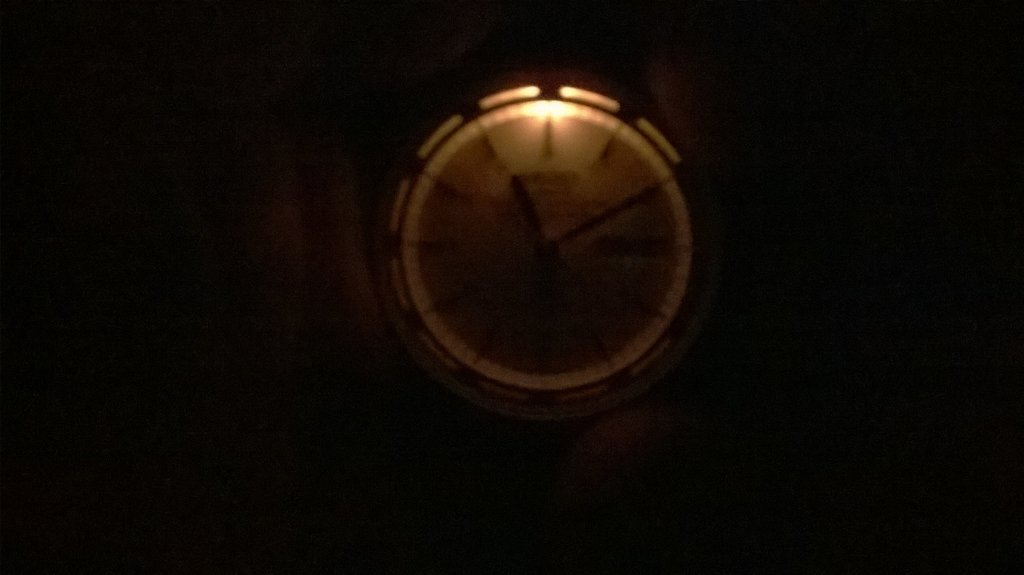
Where is `light`? The image size is (1024, 575). light is located at coordinates (545, 108).